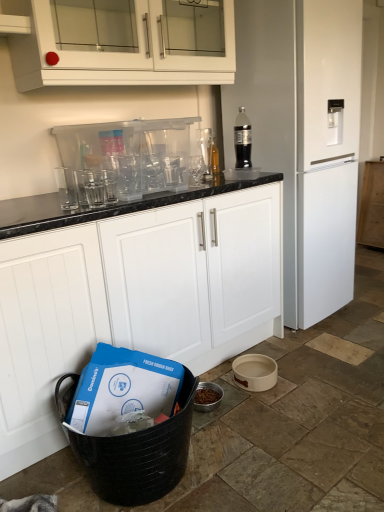
Question: Is white matte cabinet at right, arranged as the third cabinetry when viewed from the left, to the left of white matte refrigerator at right from the viewer's perspective?

Choices:
 (A) yes
 (B) no

Answer: (B)

Question: Considering the relative sizes of white matte cabinet at right, the 3th cabinetry positioned from the front, and white matte refrigerator at right in the image provided, is white matte cabinet at right, the 3th cabinetry positioned from the front, shorter than white matte refrigerator at right?

Choices:
 (A) no
 (B) yes

Answer: (B)

Question: From a real-world perspective, is white matte cabinet at right, the 1th cabinetry when ordered from right to left, positioned over white matte refrigerator at right based on gravity?

Choices:
 (A) no
 (B) yes

Answer: (A)

Question: From a real-world perspective, is white matte cabinet at right, the 1th cabinetry viewed from the back, positioned under white matte refrigerator at right based on gravity?

Choices:
 (A) yes
 (B) no

Answer: (A)

Question: Does white matte cabinet at right, arranged as the third cabinetry when viewed from the left, have a lesser width compared to white matte refrigerator at right?

Choices:
 (A) yes
 (B) no

Answer: (A)

Question: From the image's perspective, is white ceramic bowl at lower right, which is the 1th appliance from right to left, below transparent plastic glasses at upper center, the 1th appliance from the left?

Choices:
 (A) yes
 (B) no

Answer: (A)

Question: Is white ceramic bowl at lower right, which is the 2th appliance in top-to-bottom order, wider than transparent plastic glasses at upper center, which appears as the 2th appliance when viewed from the right?

Choices:
 (A) yes
 (B) no

Answer: (B)

Question: Is white ceramic bowl at lower right, the second appliance when ordered from left to right, located outside transparent plastic glasses at upper center, positioned as the 1th appliance in top-to-bottom order?

Choices:
 (A) yes
 (B) no

Answer: (A)

Question: Does white ceramic bowl at lower right, which is the 2th appliance in top-to-bottom order, have a larger size compared to transparent plastic glasses at upper center, which appears as the 2th appliance when viewed from the right?

Choices:
 (A) yes
 (B) no

Answer: (B)

Question: Is the position of white ceramic bowl at lower right, acting as the 1th appliance starting from the bottom, more distant than that of transparent plastic glasses at upper center, acting as the second appliance starting from the bottom?

Choices:
 (A) no
 (B) yes

Answer: (B)

Question: From a real-world perspective, is white ceramic bowl at lower right, acting as the 1th appliance starting from the bottom, positioned under transparent plastic glasses at upper center, acting as the second appliance starting from the bottom, based on gravity?

Choices:
 (A) yes
 (B) no

Answer: (A)

Question: Could white matte refrigerator at right be considered to be inside white glossy cabinet at upper center, the 2th cabinetry from the right?

Choices:
 (A) no
 (B) yes

Answer: (A)